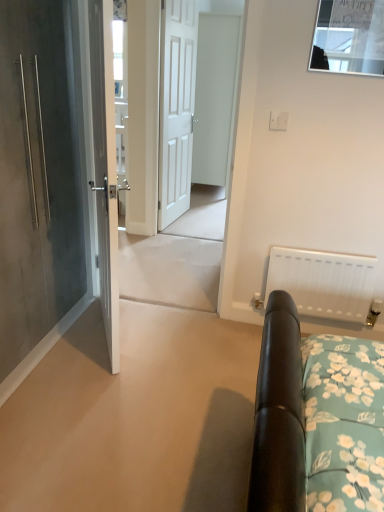
Question: Does clear glass window at upper center appear on the left side of white wooden door at center?

Choices:
 (A) no
 (B) yes

Answer: (A)

Question: Can you confirm if clear glass window at upper center is taller than white wooden door at center?

Choices:
 (A) yes
 (B) no

Answer: (B)

Question: Are clear glass window at upper center and white wooden door at center located far from each other?

Choices:
 (A) no
 (B) yes

Answer: (B)

Question: Can you confirm if clear glass window at upper center is shorter than white wooden door at center?

Choices:
 (A) no
 (B) yes

Answer: (B)

Question: Considering the relative positions of clear glass window at upper center and white wooden door at center in the image provided, is clear glass window at upper center behind white wooden door at center?

Choices:
 (A) no
 (B) yes

Answer: (A)

Question: In terms of width, does white matte radiator at right look wider or thinner when compared to white glossy door at center, which is the 3th door from right to left?

Choices:
 (A) wide
 (B) thin

Answer: (B)

Question: Is point (359, 307) positioned closer to the camera than point (91, 76)?

Choices:
 (A) farther
 (B) closer

Answer: (A)

Question: From the image's perspective, is white matte radiator at right located above or below white glossy door at center, positioned as the second door in left-to-right order?

Choices:
 (A) below
 (B) above

Answer: (A)

Question: Would you say white matte radiator at right is to the left or to the right of white glossy door at center, which is the 3th door from right to left, in the picture?

Choices:
 (A) right
 (B) left

Answer: (A)

Question: Considering the relative positions of matte gray door at left, acting as the 1th door starting from the left, and white matte radiator at right in the image provided, is matte gray door at left, acting as the 1th door starting from the left, to the left or to the right of white matte radiator at right?

Choices:
 (A) right
 (B) left

Answer: (B)

Question: In terms of height, does matte gray door at left, acting as the 1th door starting from the left, look taller or shorter compared to white matte radiator at right?

Choices:
 (A) short
 (B) tall

Answer: (B)

Question: Relative to white matte radiator at right, is matte gray door at left, the 4th door viewed from the right, in front or behind?

Choices:
 (A) front
 (B) behind

Answer: (A)

Question: From the image's perspective, is matte gray door at left, acting as the 1th door starting from the left, located above or below white matte radiator at right?

Choices:
 (A) below
 (B) above

Answer: (B)

Question: Is white matte door at center, which is the first door from right to left, wider or thinner than white matte door at center, the 3th door when ordered from left to right?

Choices:
 (A) wide
 (B) thin

Answer: (A)

Question: Relative to white matte door at center, marked as the second door in a right-to-left arrangement, is white matte door at center, which is the first door from right to left, in front or behind?

Choices:
 (A) behind
 (B) front

Answer: (A)